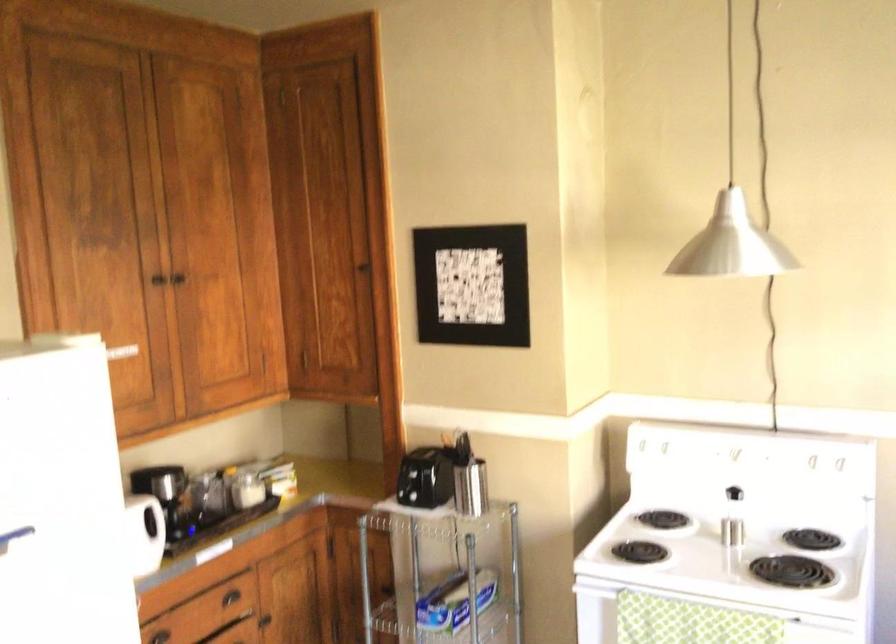
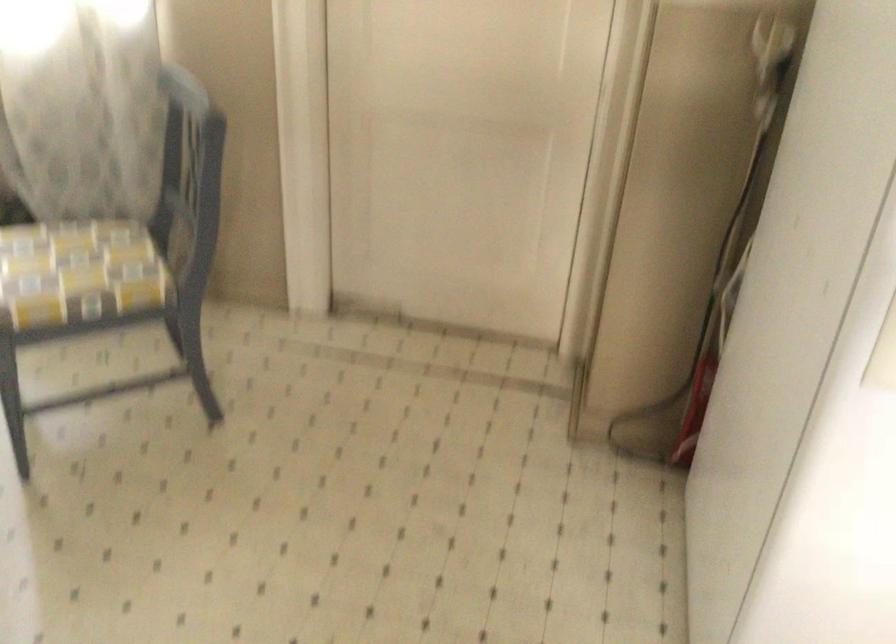
From the picture: The first image is from the beginning of the video and the second image is from the end. How did the camera likely rotate when shooting the video?

The camera rotated toward left-down.